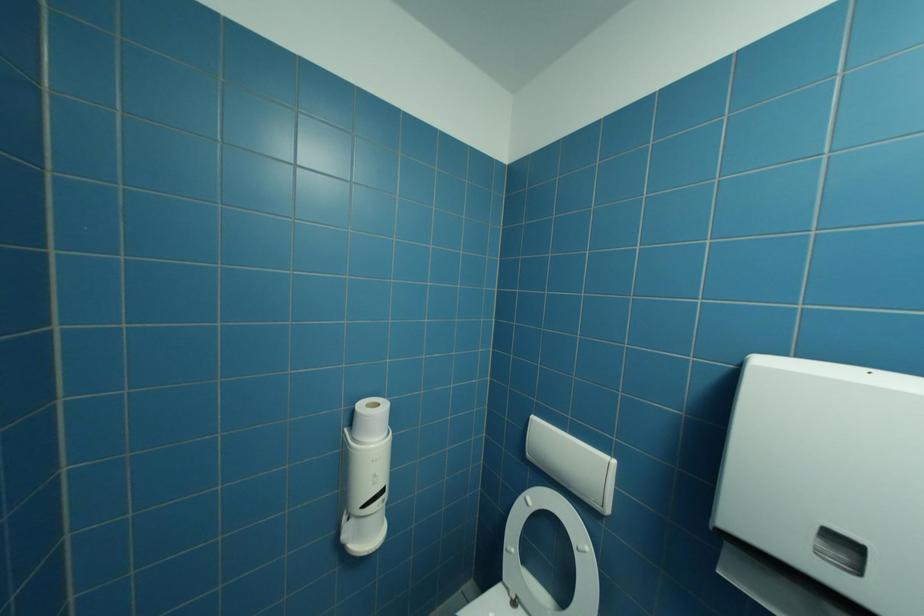
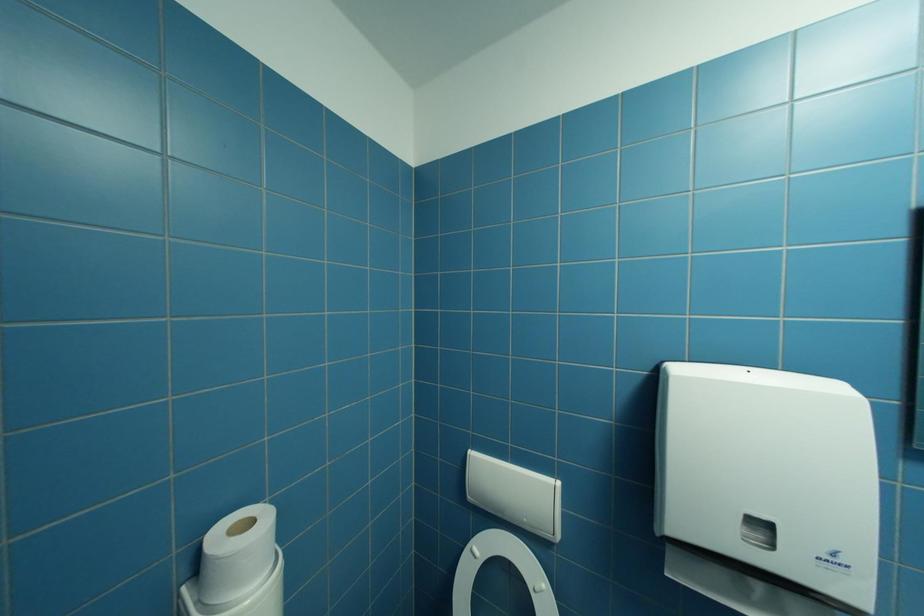
Question: How did the camera likely rotate?

Choices:
 (A) Left
 (B) Right
 (C) Up
 (D) Down

Answer: (B)